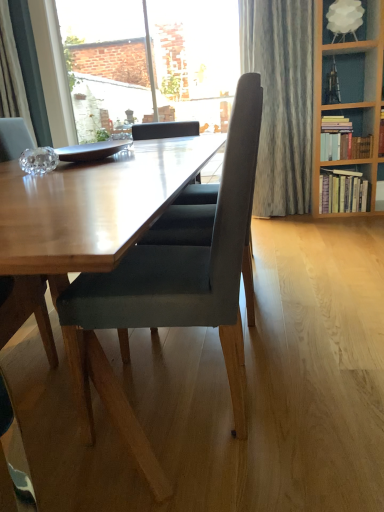
Image resolution: width=384 pixels, height=512 pixels. What do you see at coordinates (91, 208) in the screenshot?
I see `wooden table at center` at bounding box center [91, 208].

Describe the element at coordinates (342, 140) in the screenshot. I see `hardcover books at upper right, which is counted as the first book, starting from the top` at that location.

Measure the distance between point (167, 102) and camera.

Point (167, 102) and camera are 5.32 meters apart.

This screenshot has height=512, width=384. I want to click on hardcover books at right, which appears as the 2th book when viewed from the top, so click(342, 191).

Is velvet grey chair at center inside or outside of white fabric lampshade at upper right?

velvet grey chair at center is not inside white fabric lampshade at upper right, it's outside.

Looking at this image, what's the angular difference between velvet grey chair at center and white fabric lampshade at upper right's facing directions?

velvet grey chair at center and white fabric lampshade at upper right are facing 87.2 degrees away from each other.

Is point (256, 153) closer or farther from the camera than point (328, 38)?

Point (256, 153) is positioned farther from the camera compared to point (328, 38).

Is velvet grey chair at center far from white fabric lampshade at upper right?

Absolutely, velvet grey chair at center is distant from white fabric lampshade at upper right.

Can you confirm if transparent glass window at upper center is thinner than hardcover books at upper right, which is counted as the first book, starting from the top?

Correct, the width of transparent glass window at upper center is less than that of hardcover books at upper right, which is counted as the first book, starting from the top.

Are transparent glass window at upper center and hardcover books at upper right, the 2th book from the bottom, beside each other?

No, transparent glass window at upper center is not in contact with hardcover books at upper right, the 2th book from the bottom.

In the scene shown: From a real-world perspective, is transparent glass window at upper center positioned over hardcover books at upper right, which is counted as the first book, starting from the top, based on gravity?

Yes, from a real-world perspective, transparent glass window at upper center is over hardcover books at upper right, which is counted as the first book, starting from the top

In the image, is transparent glass window at upper center positioned in front of or behind hardcover books at upper right, which is counted as the first book, starting from the top?

transparent glass window at upper center is behind hardcover books at upper right, which is counted as the first book, starting from the top.

Is hardcover books at upper right, which is counted as the first book, starting from the top, in front of or behind white fabric lampshade at upper right in the image?

Clearly, hardcover books at upper right, which is counted as the first book, starting from the top, is behind white fabric lampshade at upper right.

Is hardcover books at upper right, the 2th book from the bottom, thinner than white fabric lampshade at upper right?

Yes, hardcover books at upper right, the 2th book from the bottom, is thinner than white fabric lampshade at upper right.

From the image's perspective, which one is positioned lower, hardcover books at upper right, which is counted as the first book, starting from the top, or white fabric lampshade at upper right?

hardcover books at upper right, which is counted as the first book, starting from the top, from the image's perspective.

Measure the distance from wooden table at center to white fabric lampshade at upper right.

wooden table at center and white fabric lampshade at upper right are 2.54 meters apart.

Based on the photo, in terms of width, does wooden table at center look wider or thinner when compared to white fabric lampshade at upper right?

Clearly, wooden table at center has more width compared to white fabric lampshade at upper right.

From the image's perspective, between wooden table at center and white fabric lampshade at upper right, who is located below?

wooden table at center is shown below in the image.

Can you confirm if wooden table at center is smaller than white fabric lampshade at upper right?

Incorrect, wooden table at center is not smaller in size than white fabric lampshade at upper right.

Which is nearer, (x=4, y=231) or (x=331, y=197)?

Point (x=4, y=231) appears to be closer to the viewer than point (x=331, y=197).

From the image's perspective, is wooden table at center on top of hardcover books at right, which appears as the 2th book when viewed from the top?

No.

Is wooden table at center taller or shorter than hardcover books at right, which appears as the 2th book when viewed from the top?

In the image, wooden table at center appears to be shorter than hardcover books at right, which appears as the 2th book when viewed from the top.

Considering the relative sizes of wooden table at center and hardcover books at right, which appears as the 2th book when viewed from the top, in the image provided, is wooden table at center smaller than hardcover books at right, which appears as the 2th book when viewed from the top,?

No, wooden table at center is not smaller than hardcover books at right, which appears as the 2th book when viewed from the top.

Is velvet grey chair at center facing away from hardcover books at right, which appears as the 2th book when viewed from the top?

No, velvet grey chair at center's orientation is not away from hardcover books at right, which appears as the 2th book when viewed from the top.

From the picture: Can you see velvet grey chair at center touching hardcover books at right, which appears as the 2th book when viewed from the top?

No, velvet grey chair at center is not in contact with hardcover books at right, which appears as the 2th book when viewed from the top.

Which of these two, velvet grey chair at center or hardcover books at right, which is counted as the first book, starting from the bottom, is thinner?

hardcover books at right, which is counted as the first book, starting from the bottom, is thinner.

From a real-world perspective, is velvet grey chair at center above or below hardcover books at right, which is counted as the first book, starting from the bottom?

From a real-world perspective, velvet grey chair at center is physically above hardcover books at right, which is counted as the first book, starting from the bottom.

Based on the photo, is transparent glass window at upper center looking in the opposite direction of hardcover books at right, which appears as the 2th book when viewed from the top?

No.

Which of these two, transparent glass window at upper center or hardcover books at right, which is counted as the first book, starting from the bottom, stands shorter?

hardcover books at right, which is counted as the first book, starting from the bottom, is shorter.

Is the depth of transparent glass window at upper center less than that of hardcover books at right, which appears as the 2th book when viewed from the top?

No, it is not.

From a real-world perspective, is transparent glass window at upper center physically above hardcover books at right, which is counted as the first book, starting from the bottom?

Correct, in the physical world, transparent glass window at upper center is higher than hardcover books at right, which is counted as the first book, starting from the bottom.

Where is `shelf above the velvet grey chair at center (from a real-world perspective)`? The width and height of the screenshot is (384, 512). shelf above the velvet grey chair at center (from a real-world perspective) is located at coordinates (367, 20).

Image resolution: width=384 pixels, height=512 pixels. I want to click on the 1st book counting from the right side of the transparent glass window at upper center, so click(x=342, y=140).

Estimate the real-world distances between objects in this image. Which object is closer to wooden table at center, hardcover books at right, which appears as the 2th book when viewed from the top, or hardcover books at upper right, the 2th book from the bottom?

hardcover books at upper right, the 2th book from the bottom, is positioned closer to the anchor wooden table at center.

When comparing their distances from hardcover books at upper right, the 2th book from the bottom, does velvet grey chair at center or transparent glass window at upper center seem closer?

velvet grey chair at center lies closer to hardcover books at upper right, the 2th book from the bottom, than the other object.

When comparing their distances from white fabric lampshade at upper right, does hardcover books at upper right, the 2th book from the bottom, or velvet grey chair at center seem closer?

hardcover books at upper right, the 2th book from the bottom, lies closer to white fabric lampshade at upper right than the other object.

Looking at the image, which one is located closer to velvet grey chair at center, hardcover books at upper right, which is counted as the first book, starting from the top, or hardcover books at right, which is counted as the first book, starting from the bottom?

hardcover books at right, which is counted as the first book, starting from the bottom, lies closer to velvet grey chair at center than the other object.

Which object lies further to the anchor point velvet grey chair at center, transparent glass window at upper center or hardcover books at right, which is counted as the first book, starting from the bottom?

The object further to velvet grey chair at center is transparent glass window at upper center.

Looking at the image, which one is located further to white fabric lampshade at upper right, hardcover books at right, which appears as the 2th book when viewed from the top, or transparent glass window at upper center?

transparent glass window at upper center is further to white fabric lampshade at upper right.

From the image, which object appears to be nearer to transparent glass window at upper center, hardcover books at right, which is counted as the first book, starting from the bottom, or white fabric lampshade at upper right?

white fabric lampshade at upper right is closer to transparent glass window at upper center.

When comparing their distances from hardcover books at right, which is counted as the first book, starting from the bottom, does hardcover books at upper right, the 2th book from the bottom, or transparent glass window at upper center seem closer?

hardcover books at upper right, the 2th book from the bottom, is positioned closer to the anchor hardcover books at right, which is counted as the first book, starting from the bottom.

The height and width of the screenshot is (512, 384). I want to click on shelf between wooden table at center and transparent glass window at upper center along the z-axis, so click(x=367, y=20).

At what (x,y) coordinates should I click in order to perform the action: click on chair between wooden table at center and white fabric lampshade at upper right in the front-back direction. Please return your answer as a coordinate pair (x, y). This screenshot has width=384, height=512. Looking at the image, I should click on [x=176, y=275].

Image resolution: width=384 pixels, height=512 pixels. In order to click on shelf positioned between velvet grey chair at center and hardcover books at right, which appears as the 2th book when viewed from the top, from near to far in this screenshot , I will do `click(367, 20)`.

This screenshot has height=512, width=384. What are the coordinates of `chair located between wooden table at center and transparent glass window at upper center in the depth direction` in the screenshot? It's located at [176, 275].